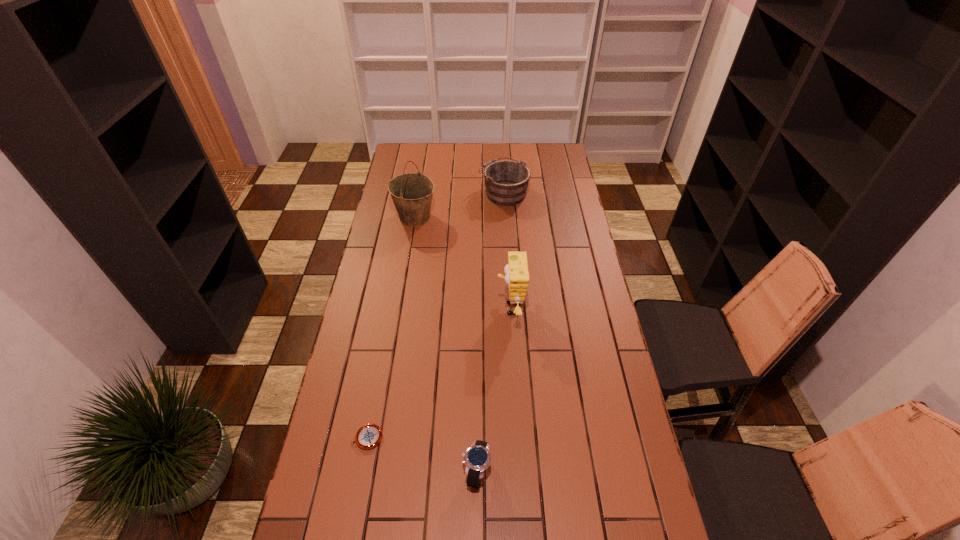
At what (x,y) coordinates should I click in order to perform the action: click on vacant area situated 0.380m on the front-facing side of the second tallest object. Please return your answer as a coordinate pair (x, y). The height and width of the screenshot is (540, 960). Looking at the image, I should click on (393, 308).

I want to click on free spot located on the front-facing side of the second tallest object, so click(x=403, y=308).

What are the coordinates of `vacant area located 0.250m on the left of the third shortest object` in the screenshot? It's located at (426, 193).

What are the coordinates of `free location located 0.090m on the left of the second shortest object` in the screenshot? It's located at (430, 471).

Locate an element on the screen. blank space located on the right of the compass is located at coordinates (493, 437).

The height and width of the screenshot is (540, 960). In order to click on wine bucket at the left edge in this screenshot , I will do coord(412,193).

At what (x,y) coordinates should I click in order to perform the action: click on compass situated at the left edge. Please return your answer as a coordinate pair (x, y). This screenshot has height=540, width=960. Looking at the image, I should click on (368, 436).

The height and width of the screenshot is (540, 960). In order to click on free spot at the far edge of the desktop in this screenshot , I will do `click(526, 147)`.

Where is `blank space at the left edge of the desktop`? blank space at the left edge of the desktop is located at coordinates (384, 225).

In the image, there is a desktop. Where is `vacant space at the right edge`? Image resolution: width=960 pixels, height=540 pixels. vacant space at the right edge is located at coordinates (600, 404).